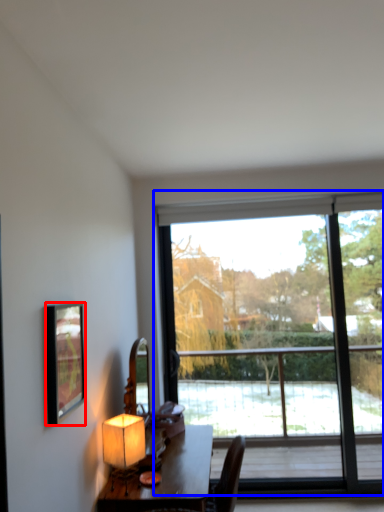
Question: Which object is further to the camera taking this photo, picture frame (highlighted by a red box) or window (highlighted by a blue box)?

Choices:
 (A) picture frame
 (B) window

Answer: (B)